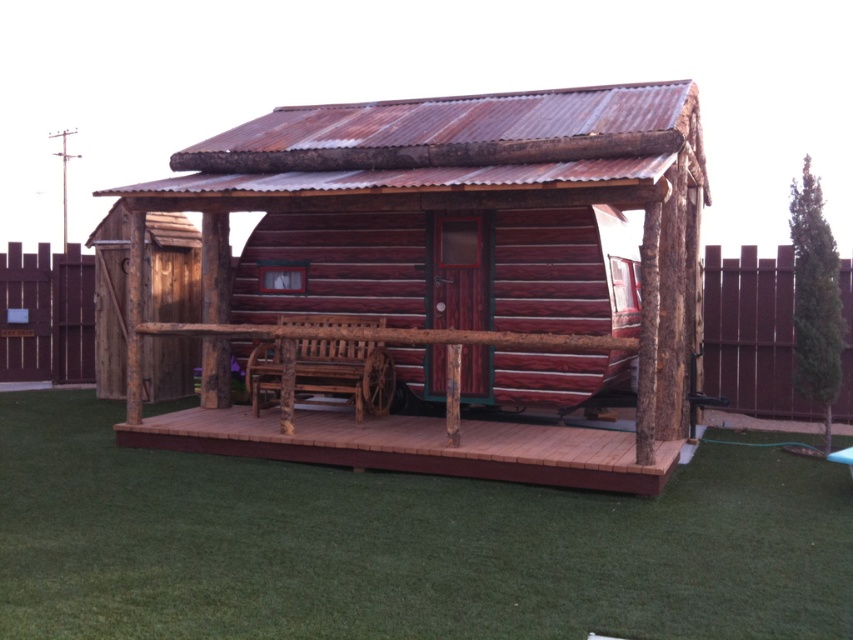
You are a gardener who wants to mow the green grass at lower center. However, you need to avoid the brown wooden deck at center. Based on the scene, which area is shorter and therefore safe to mow?

The green grass at lower center is shorter than the brown wooden deck at center, so it is safe to mow the green grass at lower center without damaging the deck.

Based on the photo, you are standing on the ground near the brown wooden deck at center and the brown wooden fence at right. Which structure is lower in height?

The brown wooden deck at center has a lesser height compared to the brown wooden fence at right, so the brown wooden deck at center is lower in height.